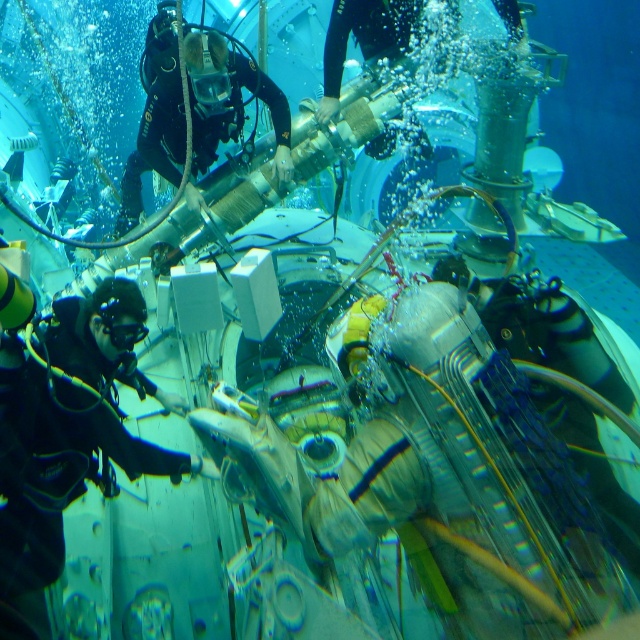
Question: Which object is closer to the camera taking this photo?

Choices:
 (A) black rubber diving suit at left
 (B) black matte goggles at center

Answer: (A)

Question: Can you confirm if black rubber diving suit at left is smaller than black rubber diver at upper left?

Choices:
 (A) yes
 (B) no

Answer: (A)

Question: Estimate the real-world distances between objects in this image. Which object is closer to the black rubber diving suit at left?

Choices:
 (A) black rubber diver at upper left
 (B) black matte goggles at center

Answer: (B)

Question: Which object is the farthest from the black rubber diving suit at left?

Choices:
 (A) black rubber diver at upper left
 (B) black matte goggles at center

Answer: (A)

Question: Is black rubber diving suit at left above black rubber diver at upper left?

Choices:
 (A) no
 (B) yes

Answer: (A)

Question: Does black rubber diving suit at left appear on the right side of black matte goggles at center?

Choices:
 (A) yes
 (B) no

Answer: (B)